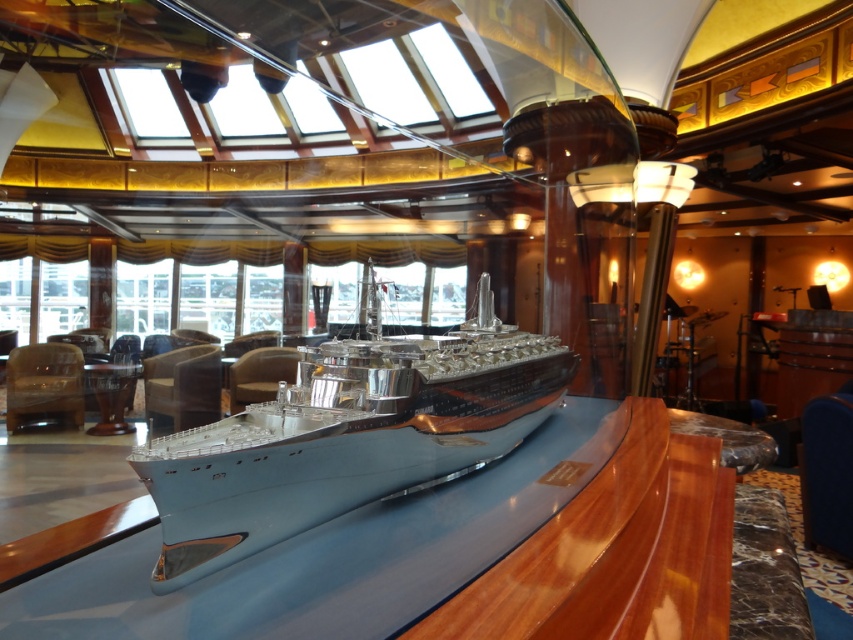
Question: Does blue fabric armchair at lower right have a larger size compared to leather armchair at center?

Choices:
 (A) yes
 (B) no

Answer: (B)

Question: Can you confirm if light blue metallic ship at center is positioned to the right of blue fabric armchair at lower right?

Choices:
 (A) no
 (B) yes

Answer: (A)

Question: Does light blue metallic ship at center appear on the right side of matte brown leather armchair at center?

Choices:
 (A) no
 (B) yes

Answer: (B)

Question: Considering the real-world distances, which object is closest to the light blue metallic ship at center?

Choices:
 (A) leather armchair at center
 (B) matte brown armchair at left
 (C) blue fabric armchair at lower right

Answer: (C)

Question: Which object is farther from the camera taking this photo?

Choices:
 (A) leather armchair at center
 (B) blue fabric armchair at lower right
 (C) matte brown leather armchair at center
 (D) matte brown armchair at left

Answer: (C)

Question: Which point appears closest to the camera in this image?

Choices:
 (A) (274, 416)
 (B) (287, 365)

Answer: (A)